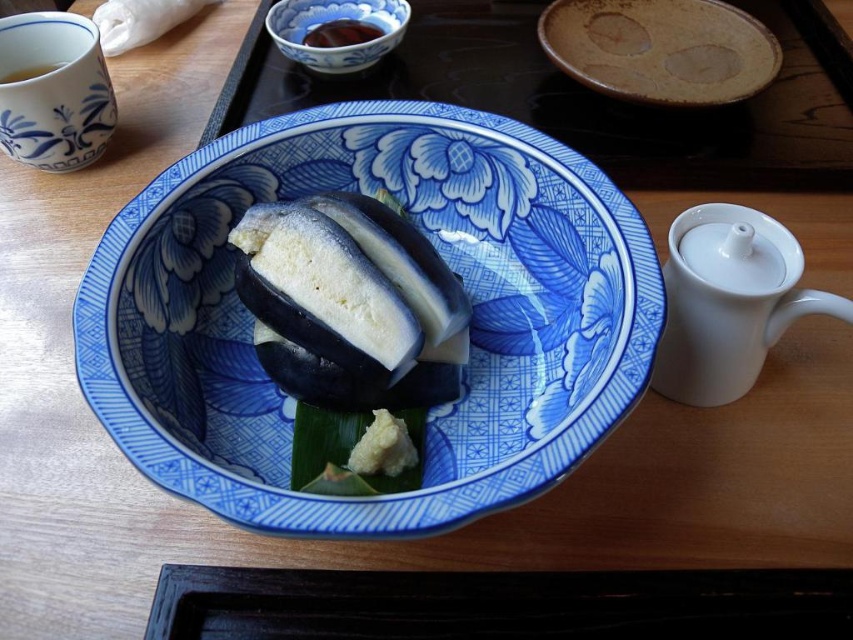
Question: Does brown matte platter at upper center appear under matte porcelain cup at upper left?

Choices:
 (A) yes
 (B) no

Answer: (B)

Question: Is matte porcelain cup at upper left smaller than brown glossy sauce at upper center?

Choices:
 (A) no
 (B) yes

Answer: (A)

Question: Estimate the real-world distances between objects in this image. Which object is closer to the blue porcelain bowl at upper center?

Choices:
 (A) blue porcelain plate at center
 (B) brown matte platter at upper center

Answer: (B)

Question: Does blue porcelain plate at center have a smaller size compared to brown matte platter at upper center?

Choices:
 (A) yes
 (B) no

Answer: (B)

Question: Which of the following is the closest to the observer?

Choices:
 (A) blue porcelain plate at center
 (B) brown matte platter at upper center

Answer: (A)

Question: Among these points, which one is nearest to the camera?

Choices:
 (A) (53, 70)
 (B) (793, 253)
 (C) (541, 138)
 (D) (358, 45)

Answer: (B)